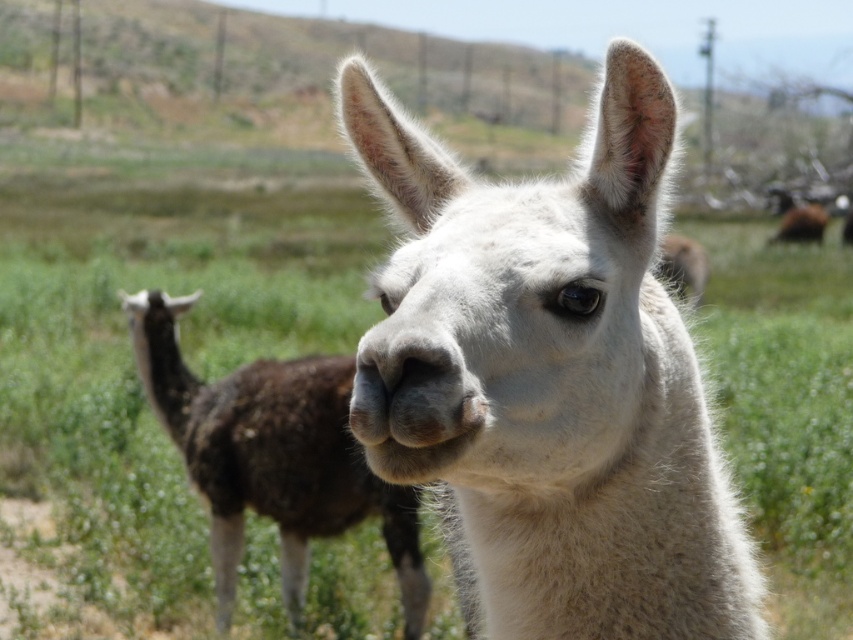
You are a photographer standing at the center of the field. You want to take a photo that includes both the white woolen alpaca at center and the fuzzy brown alpaca at center. Given that your camera has a maximum focus range of 7 feet, will both alpacas be in focus?

The distance between the white woolen alpaca at center and the fuzzy brown alpaca at center is 6.94 feet, which is within the camera maximum focus range of 7 feet. Therefore, both alpacas will be in focus.